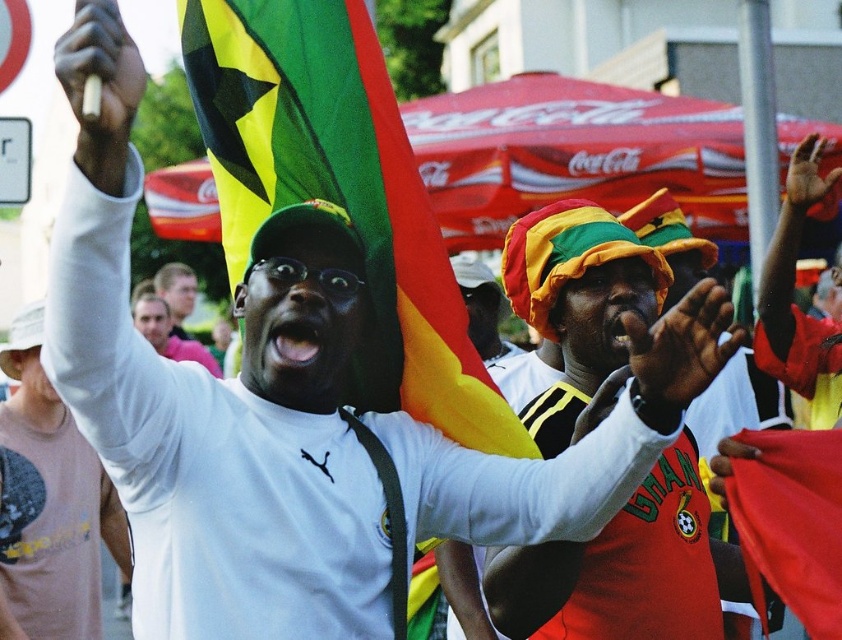
You are standing at the origin point of the image coordinate system. You see two points, point (400, 403) and point (12, 328). Which point is closer to you?

Point (400, 403) is in front of point (12, 328), so it is closer to you.

In the scene, there is a white matte shirt at upper center and a red fabric flag at upper center. Which object has a greater width?

The white matte shirt at upper center has a greater width than the red fabric flag at upper center.